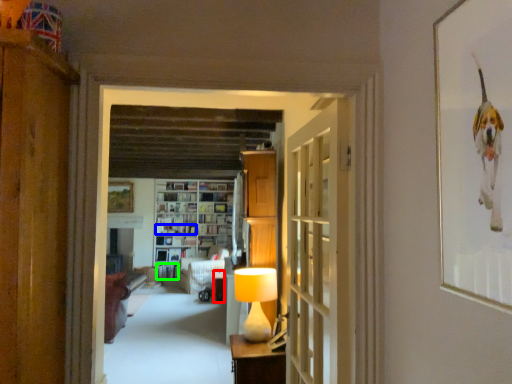
Question: Which object is the closest to the table (highlighted by a red box)? Choose among these: book (highlighted by a blue box) or book (highlighted by a green box).

Choices:
 (A) book
 (B) book

Answer: (B)